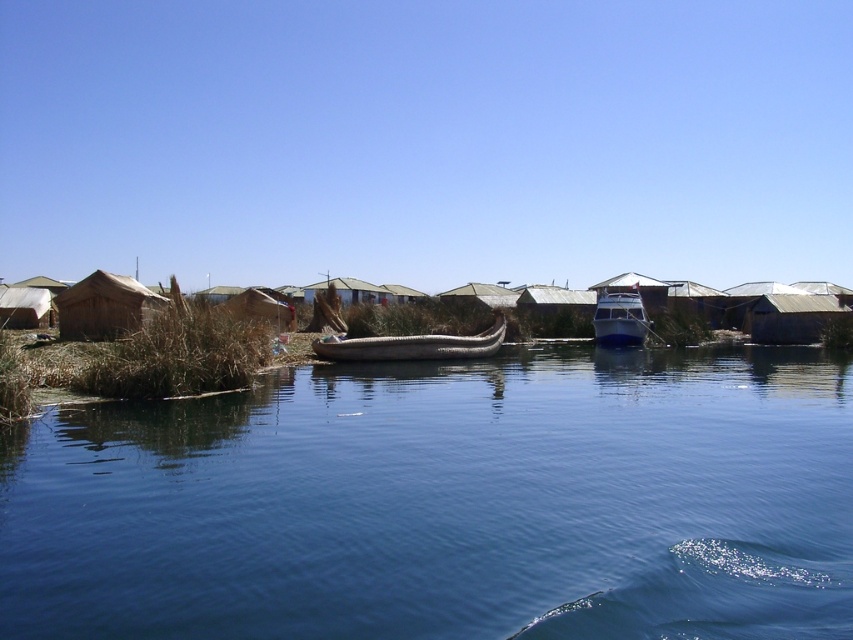
Can you confirm if clear blue water at center is bigger than brown woven boat at center?

Yes, clear blue water at center is bigger than brown woven boat at center.

Who is shorter, clear blue water at center or brown woven boat at center?

Standing shorter between the two is clear blue water at center.

Between point (370, 561) and point (389, 352), which one is positioned behind?

The point (389, 352) is more distant.

Find the location of a particular element. The image size is (853, 640). clear blue water at center is located at coordinates tap(447, 502).

At what (x,y) coordinates should I click in order to perform the action: click on clear blue water at center. Please return your answer as a coordinate pair (x, y). Looking at the image, I should click on [447, 502].

Does clear blue water at center have a larger size compared to metallic blue boat at center?

Yes, clear blue water at center is bigger than metallic blue boat at center.

Who is more forward, (384, 419) or (624, 317)?

Point (384, 419) is in front.

This screenshot has height=640, width=853. I want to click on clear blue water at center, so click(447, 502).

Is point (332, 352) closer to camera compared to point (621, 346)?

Yes, point (332, 352) is closer to viewer.

Does brown woven boat at center have a greater height compared to metallic blue boat at center?

Yes.

Who is more forward, (347,348) or (622,342)?

Point (347,348) is in front.

Where is `brown woven boat at center`? Image resolution: width=853 pixels, height=640 pixels. brown woven boat at center is located at coordinates (412, 346).